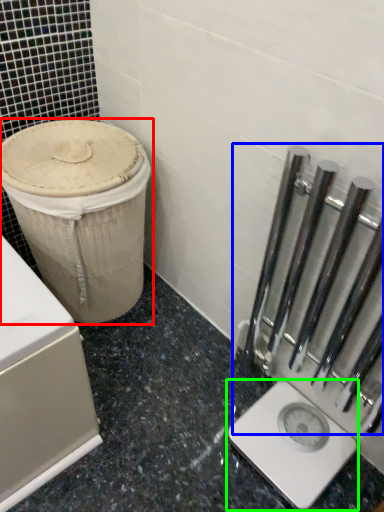
Question: Which object is positioned farthest from waste container (highlighted by a red box)? Select from rail (highlighted by a blue box) and scale (highlighted by a green box).

Choices:
 (A) rail
 (B) scale

Answer: (B)